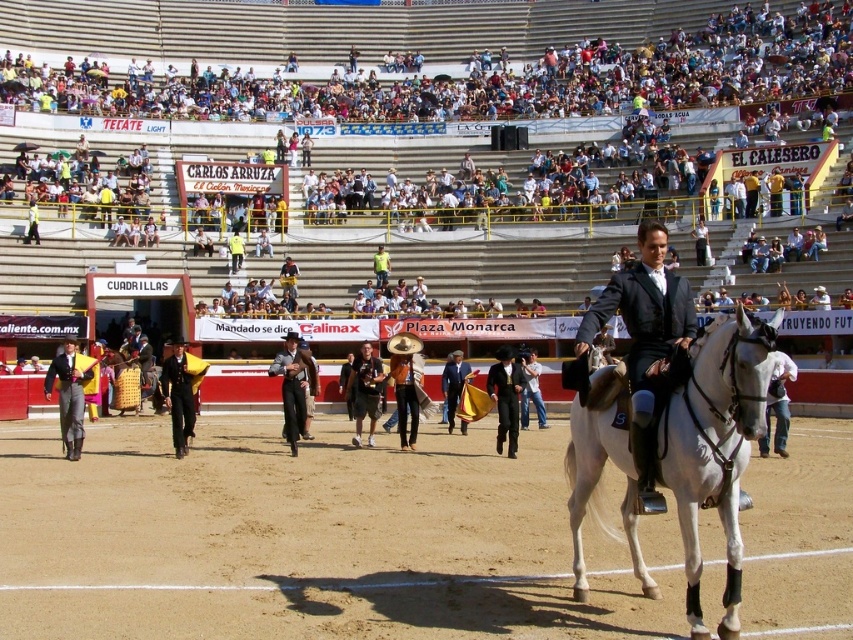
You are a photographer positioned at the front of the arena. You want to take a photo that clearly shows both the white glossy horse at center and the black leather suit at center. Which object should you focus on first to ensure both are in sharp focus?

The white glossy horse at center is closer to the viewer than the black leather suit at center. To ensure both are in sharp focus, you should focus on the white glossy horse at center first, as focusing on the closer object will also keep the farther one in acceptable focus range.

You are a spectator at the bullfighting arena. You see the white glossy horse at center and the black leather suit at center. Which object is positioned lower in the image?

The white glossy horse at center is located below the black leather suit at center, so the horse is positioned lower in the image.

You are a photographer positioned at the arena entrance. You need to capture a photo that includes both the white cotton shirt at upper center and the white glossy horse at center. Considering their sizes, which one will appear larger in the photo?

The white cotton shirt at upper center is much taller than the white glossy horse at center, so it will appear larger in the photo.